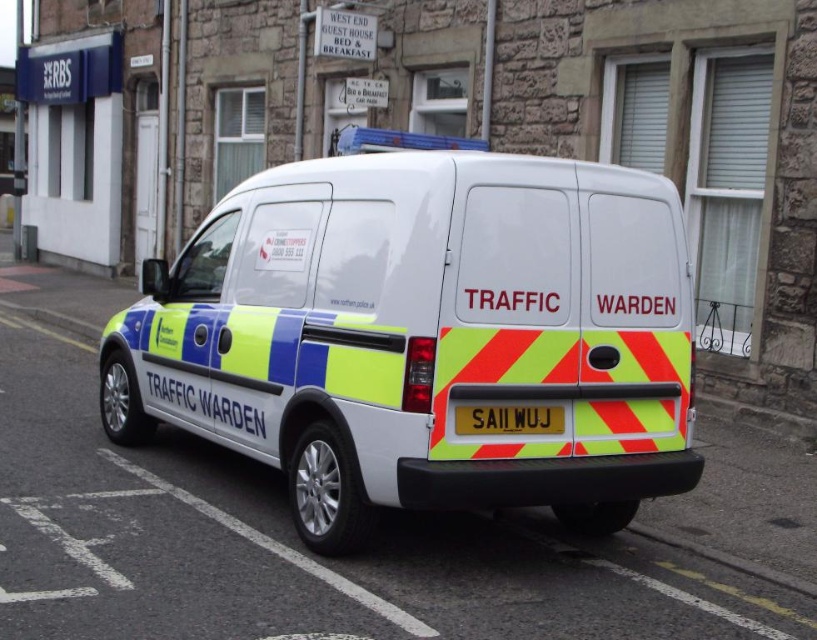
Question: Is white glossy van at center positioned in front of yellow reflective plate at rear?

Choices:
 (A) yes
 (B) no

Answer: (A)

Question: Which object appears farthest from the camera in this image?

Choices:
 (A) yellow reflective plate at rear
 (B) white glossy van at center

Answer: (A)

Question: Is white glossy van at center smaller than yellow reflective plate at rear?

Choices:
 (A) yes
 (B) no

Answer: (B)

Question: Which of the following is the farthest from the observer?

Choices:
 (A) (547, 248)
 (B) (534, 433)

Answer: (A)

Question: Is white glossy van at center wider than yellow reflective plate at rear?

Choices:
 (A) no
 (B) yes

Answer: (B)